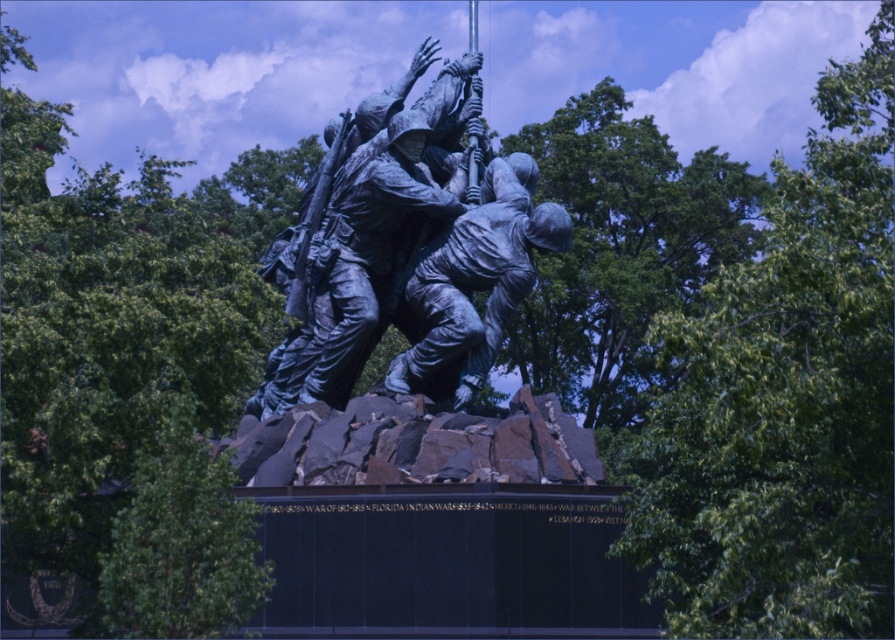
Question: Among these points, which one is nearest to the camera?

Choices:
 (A) (360, 282)
 (B) (450, 337)

Answer: (B)

Question: Estimate the real-world distances between objects in this image. Which object is closer to the bronze statue of soldiers at center?

Choices:
 (A) blue-green polished bronze statue at center
 (B) bronze statue of soldier at center

Answer: (A)

Question: Does bronze statue of soldiers at center lie in front of bronze statue of soldier at center?

Choices:
 (A) no
 (B) yes

Answer: (A)

Question: Is blue-green polished bronze statue at center to the left of bronze statue of soldier at center from the viewer's perspective?

Choices:
 (A) no
 (B) yes

Answer: (B)

Question: Which of these objects is positioned farthest from the bronze statue of soldier at center?

Choices:
 (A) bronze statue of soldiers at center
 (B) blue-green polished bronze statue at center

Answer: (A)

Question: Does bronze statue of soldiers at center have a smaller size compared to bronze statue of soldier at center?

Choices:
 (A) no
 (B) yes

Answer: (A)